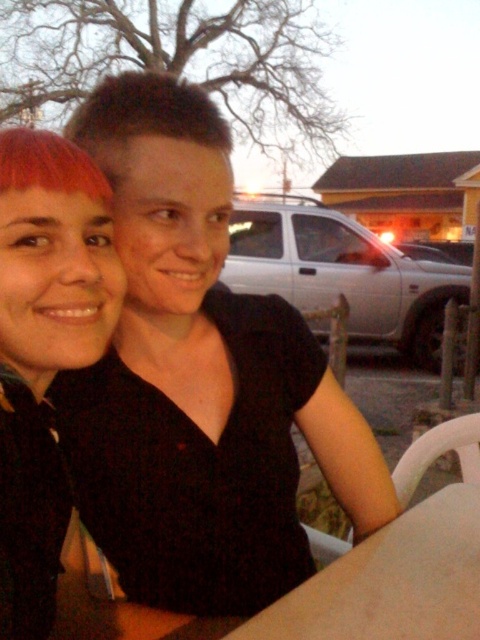
Question: Is black matte shirt at center wider than dark brown short hair at upper center?

Choices:
 (A) no
 (B) yes

Answer: (B)

Question: Can you confirm if black matte shirt at center is positioned to the left of matte black hair at left?

Choices:
 (A) yes
 (B) no

Answer: (B)

Question: Which point appears closest to the camera in this image?

Choices:
 (A) (184, 458)
 (B) (189, 106)
 (C) (101, 296)

Answer: (C)

Question: Does matte black hair at left appear over dark brown short hair at upper center?

Choices:
 (A) no
 (B) yes

Answer: (A)

Question: Which object appears farthest from the camera in this image?

Choices:
 (A) black matte shirt at center
 (B) matte black hair at left
 (C) dark brown short hair at upper center

Answer: (C)

Question: Among these points, which one is nearest to the camera?

Choices:
 (A) (137, 474)
 (B) (59, 150)
 (C) (173, 120)

Answer: (B)